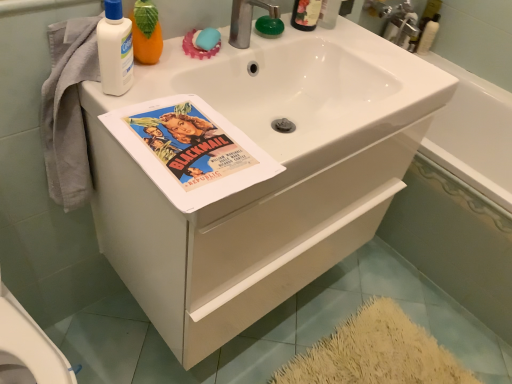
The width and height of the screenshot is (512, 384). I want to click on free space above matte paper poster at center (from a real-world perspective), so point(187,142).